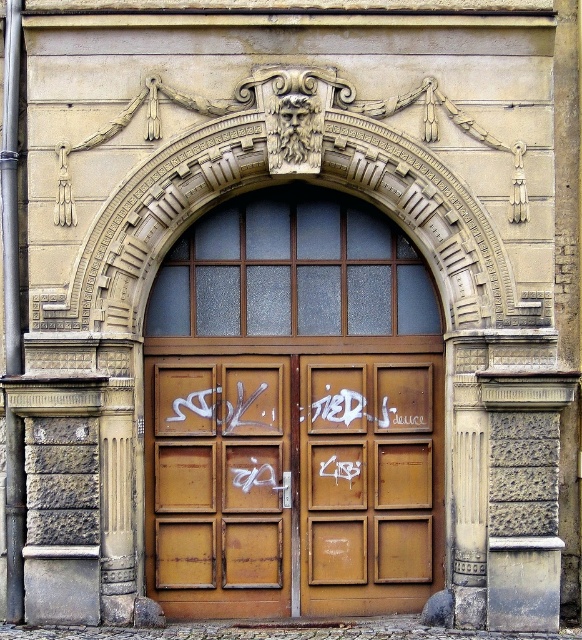
Which is above, rusty wooden door at center or rusty metal door at center?

rusty metal door at center is higher up.

Who is positioned more to the left, rusty wooden door at center or rusty metal door at center?

Positioned to the left is rusty wooden door at center.

You are a GUI agent. You are given a task and a screenshot of the screen. Output one action in this format:
    pyautogui.click(x=<x>, y=<y>)
    Task: Click on the rusty wooden door at center
    
    Given the screenshot: What is the action you would take?
    pyautogui.click(x=221, y=484)

Which is behind, point (288, 554) or point (314, 577)?

Point (314, 577)

Between rusty metal doors at center and rusty metal door at center, which one has less height?

With less height is rusty metal door at center.

Does point (409, 440) lie behind point (407, 506)?

Yes, it is behind point (407, 506).

The height and width of the screenshot is (640, 582). In order to click on rusty metal doors at center in this screenshot , I will do `click(292, 483)`.

Does point (385, 611) come behind point (211, 410)?

No, (385, 611) is closer to viewer.

Which is in front, point (239, 512) or point (161, 589)?

Positioned in front is point (239, 512).

This screenshot has height=640, width=582. I want to click on rusty metal doors at center, so click(292, 483).